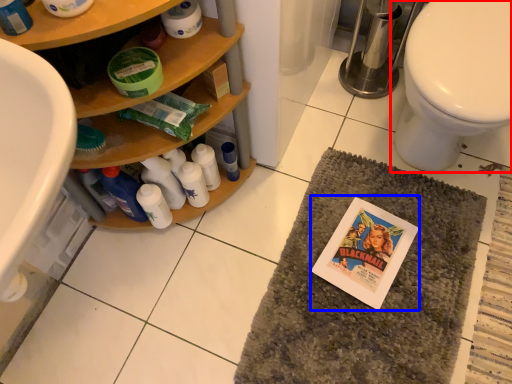
Question: Which object appears farthest to the camera in this image, toilet (highlighted by a red box) or comic book (highlighted by a blue box)?

Choices:
 (A) toilet
 (B) comic book

Answer: (B)